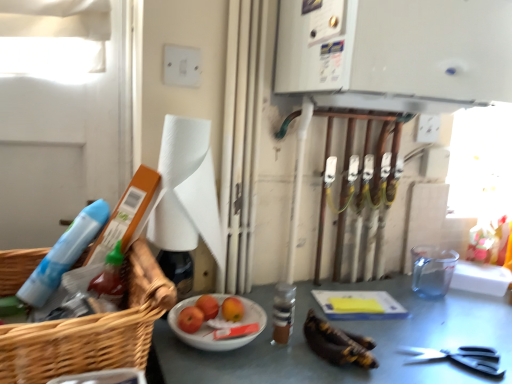
Locate an element on the screen. white glossy bowl at center is located at coordinates (211, 330).

I want to click on brown glass bottle at center, so click(283, 312).

The width and height of the screenshot is (512, 384). Describe the element at coordinates (353, 332) in the screenshot. I see `metallic gray table at center` at that location.

What is the approximate height of metallic gray table at center?

15.08 inches.

Find the location of `white paper towel at center`. white paper towel at center is located at coordinates (186, 190).

Can you confirm if smooth red apple at center, which is counted as the first fruit, starting from the back, is wider than white paper towel at center?

No, smooth red apple at center, which is counted as the first fruit, starting from the back, is not wider than white paper towel at center.

Considering the points (208, 302) and (186, 199), which point is behind, point (208, 302) or point (186, 199)?

The point (208, 302) is behind.

In the scene shown: Between smooth red apple at center, placed as the second fruit when sorted from front to back, and white paper towel at center, which one is positioned in front?

white paper towel at center.

From a real-world perspective, is metallic gray table at center below woven wood basket at left?

Yes.

Considering the positions of points (338, 322) and (23, 327), is point (338, 322) closer to camera compared to point (23, 327)?

That is False.

Consider the image. Is metallic gray table at center positioned beyond the bounds of woven wood basket at left?

Indeed, metallic gray table at center is completely outside woven wood basket at left.

Could you tell me if shiny red apples at center, which is counted as the 2th fruit, starting from the back, is turned towards woven wood basket at left?

No, shiny red apples at center, which is counted as the 2th fruit, starting from the back, is not facing towards woven wood basket at left.

Considering the relative sizes of shiny red apples at center, which is counted as the 2th fruit, starting from the back, and woven wood basket at left in the image provided, is shiny red apples at center, which is counted as the 2th fruit, starting from the back, taller than woven wood basket at left?

No, shiny red apples at center, which is counted as the 2th fruit, starting from the back, is not taller than woven wood basket at left.

Which object is wider, shiny red apples at center, which ranks as the first fruit in front-to-back order, or woven wood basket at left?

woven wood basket at left.

From a real-world perspective, which object stands above the other?

woven wood basket at left.

Are metallic gray table at center and blue plastic spray bottle at left making contact?

No, metallic gray table at center is not making contact with blue plastic spray bottle at left.

From a real-world perspective, is metallic gray table at center located higher than blue plastic spray bottle at left?

No.

Which object is further away from the camera, metallic gray table at center or blue plastic spray bottle at left?

Positioned behind is blue plastic spray bottle at left.

Where is `toilet paper above the brown glass bottle at center (from a real-world perspective)`? The height and width of the screenshot is (384, 512). toilet paper above the brown glass bottle at center (from a real-world perspective) is located at coordinates (186, 190).

Is white paper towel at center inside or outside of brown glass bottle at center?

The correct answer is: outside.

Which of these two, white paper towel at center or brown glass bottle at center, is bigger?

Bigger between the two is white paper towel at center.

From the image's perspective, which one is positioned higher, metallic gray table at center or white glossy bowl at center?

white glossy bowl at center.

Is metallic gray table at center facing towards white glossy bowl at center?

No, metallic gray table at center is not oriented towards white glossy bowl at center.

From a real-world perspective, who is located higher, metallic gray table at center or white glossy bowl at center?

white glossy bowl at center is physically above.

Considering the sizes of objects blue plastic spray bottle at left and white glossy bowl at center in the image provided, who is smaller, blue plastic spray bottle at left or white glossy bowl at center?

With smaller size is white glossy bowl at center.

From the image's perspective, relative to white glossy bowl at center, is blue plastic spray bottle at left above or below?

Clearly, from the image's perspective, blue plastic spray bottle at left is above white glossy bowl at center.

From a real-world perspective, is blue plastic spray bottle at left below white glossy bowl at center?

No, from a real-world perspective, blue plastic spray bottle at left is not under white glossy bowl at center.

Is blue plastic spray bottle at left placed right next to white glossy bowl at center?

No, blue plastic spray bottle at left is not touching white glossy bowl at center.

Image resolution: width=512 pixels, height=384 pixels. Identify the location of toilet paper that is in front of the smooth red apple at center, placed as the second fruit when sorted from front to back. (186, 190).

Where is `basket positioned vertically above the metallic gray table at center (from a real-world perspective)`? basket positioned vertically above the metallic gray table at center (from a real-world perspective) is located at coordinates (91, 331).

Considering their positions, is smooth red apple at center, placed as the second fruit when sorted from front to back, positioned closer to blue plastic spray bottle at left than black plastic scissors at lower right?

smooth red apple at center, placed as the second fruit when sorted from front to back.

When comparing their distances from brown glass bottle at center, does white glossy bowl at center or blue plastic spray bottle at left seem closer?

white glossy bowl at center is closer to brown glass bottle at center.

Considering their positions, is black plastic scissors at lower right positioned closer to brown glass bottle at center than metallic gray table at center?

Based on the image, metallic gray table at center appears to be nearer to brown glass bottle at center.

Consider the image. Estimate the real-world distances between objects in this image. Which object is further from brown glass bottle at center, shiny red apples at center, which is counted as the 2th fruit, starting from the back, or black plastic scissors at lower right?

Based on the image, black plastic scissors at lower right appears to be further to brown glass bottle at center.

From the image, which object appears to be farther from white glossy bowl at center, metallic gray table at center or smooth red apple at center, which is counted as the first fruit, starting from the back?

metallic gray table at center lies further to white glossy bowl at center than the other object.

Looking at the image, which one is located further to blue plastic spray bottle at left, white glossy bowl at center or brown glass bottle at center?

Based on the image, brown glass bottle at center appears to be further to blue plastic spray bottle at left.

Looking at the image, which one is located closer to white paper towel at center, brown glass bottle at center or metallic gray table at center?

The object closer to white paper towel at center is brown glass bottle at center.

Looking at the image, which one is located further to blue plastic spray bottle at left, brown glass bottle at center or metallic gray table at center?

metallic gray table at center is positioned further to the anchor blue plastic spray bottle at left.

Find the location of a particular element. The height and width of the screenshot is (384, 512). basket between blue plastic spray bottle at left and white glossy bowl at center is located at coordinates (91, 331).

I want to click on toilet paper between blue plastic spray bottle at left and metallic gray table at center in the horizontal direction, so click(186, 190).

What are the coordinates of `bottle situated between woven wood basket at left and metallic gray table at center from left to right` in the screenshot? It's located at click(283, 312).

You are a GUI agent. You are given a task and a screenshot of the screen. Output one action in this format:
    pyautogui.click(x=<x>, y=<y>)
    Task: Click on the fruit between blue plastic spray bottle at left and smooth red apple at center, placed as the second fruit when sorted from front to back, in the horizontal direction
    The image size is (512, 384).
    Given the screenshot: What is the action you would take?
    pyautogui.click(x=190, y=319)